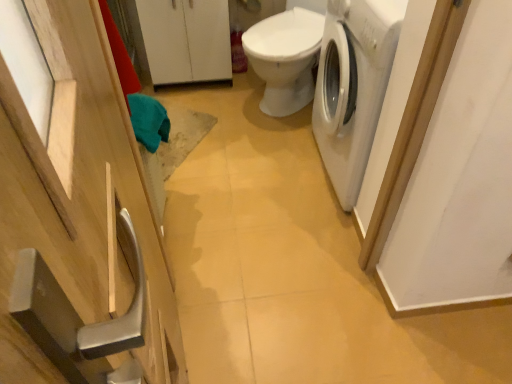
At what (x,y) coordinates should I click in order to perform the action: click on white matte cabinet at upper center, positioned as the 2th cabinetry in front-to-back order. Please return your answer as a coordinate pair (x, y). The height and width of the screenshot is (384, 512). Looking at the image, I should click on (186, 40).

Find the location of a particular element. This screenshot has height=384, width=512. natural wood cabinet at left, marked as the second cabinetry in a back-to-front arrangement is located at coordinates click(76, 211).

Find the location of `white matte washing machine at right`. white matte washing machine at right is located at coordinates (353, 86).

This screenshot has width=512, height=384. What do you see at coordinates (353, 86) in the screenshot?
I see `white matte washing machine at right` at bounding box center [353, 86].

Locate an element on the screen. This screenshot has width=512, height=384. white matte cabinet at upper center, placed as the first cabinetry when sorted from top to bottom is located at coordinates (186, 40).

From the picture: Is white matte washing machine at right positioned with its back to white matte cabinet at upper center, positioned as the 2th cabinetry in front-to-back order?

No, white matte washing machine at right is not facing away from white matte cabinet at upper center, positioned as the 2th cabinetry in front-to-back order.

Between white matte washing machine at right and white matte cabinet at upper center, placed as the first cabinetry when sorted from top to bottom, which one is positioned behind?

Positioned behind is white matte cabinet at upper center, placed as the first cabinetry when sorted from top to bottom.

Is white matte washing machine at right to the right of white matte cabinet at upper center, placed as the first cabinetry when sorted from top to bottom, from the viewer's perspective?

Indeed, white matte washing machine at right is positioned on the right side of white matte cabinet at upper center, placed as the first cabinetry when sorted from top to bottom.

Which of these two, white matte washing machine at right or white matte cabinet at upper center, arranged as the first cabinetry when viewed from the back, stands shorter?

white matte cabinet at upper center, arranged as the first cabinetry when viewed from the back.

Based on their sizes in the image, would you say white matte cabinet at upper center, arranged as the first cabinetry when viewed from the back, is bigger or smaller than white matte washing machine at right?

Considering their sizes, white matte cabinet at upper center, arranged as the first cabinetry when viewed from the back, takes up less space than white matte washing machine at right.

How far apart are white matte cabinet at upper center, the 2th cabinetry from the bottom, and white matte washing machine at right?

They are 88.44 centimeters apart.

From the picture: In terms of height, does white matte cabinet at upper center, the 2th cabinetry from the bottom, look taller or shorter compared to white matte washing machine at right?

In the image, white matte cabinet at upper center, the 2th cabinetry from the bottom, appears to be shorter than white matte washing machine at right.

Is white matte cabinet at upper center, arranged as the first cabinetry when viewed from the back, facing away from white matte washing machine at right?

white matte cabinet at upper center, arranged as the first cabinetry when viewed from the back, does not have its back to white matte washing machine at right.

Can you tell me how much natural wood cabinet at left, marked as the second cabinetry in a back-to-front arrangement, and white matte cabinet at upper center, the 2th cabinetry from the bottom, differ in facing direction?

The angular difference between natural wood cabinet at left, marked as the second cabinetry in a back-to-front arrangement, and white matte cabinet at upper center, the 2th cabinetry from the bottom, is 97.8 degrees.

Measure the distance between natural wood cabinet at left, the first cabinetry positioned from the front, and white matte cabinet at upper center, positioned as the 2th cabinetry in front-to-back order.

The distance of natural wood cabinet at left, the first cabinetry positioned from the front, from white matte cabinet at upper center, positioned as the 2th cabinetry in front-to-back order, is 1.61 meters.

Is natural wood cabinet at left, the 1th cabinetry in the bottom-to-top sequence, not close to white matte cabinet at upper center, arranged as the first cabinetry when viewed from the back?

Yes, natural wood cabinet at left, the 1th cabinetry in the bottom-to-top sequence, is far from white matte cabinet at upper center, arranged as the first cabinetry when viewed from the back.

Considering the points (55, 47) and (159, 42), which point is behind, point (55, 47) or point (159, 42)?

Positioned behind is point (159, 42).

Is white matte washing machine at right positioned with its back to white glossy toilet at center?

No, white matte washing machine at right's orientation is not away from white glossy toilet at center.

From a real-world perspective, is white matte washing machine at right physically located above or below white glossy toilet at center?

white matte washing machine at right is above white glossy toilet at center.

The height and width of the screenshot is (384, 512). In the image, there is a white matte washing machine at right. In order to click on toilet above it (from the image's perspective) in this screenshot , I will do pos(285,58).

Which is correct: white matte washing machine at right is inside white glossy toilet at center, or outside of it?

white matte washing machine at right is not enclosed by white glossy toilet at center.

At what (x,y) coordinates should I click in order to perform the action: click on toilet below the white matte cabinet at upper center, positioned as the 2th cabinetry in front-to-back order (from the image's perspective). Please return your answer as a coordinate pair (x, y). The width and height of the screenshot is (512, 384). Looking at the image, I should click on (285, 58).

In terms of width, does white glossy toilet at center look wider or thinner when compared to white matte cabinet at upper center, positioned as the 2th cabinetry in front-to-back order?

white glossy toilet at center is wider than white matte cabinet at upper center, positioned as the 2th cabinetry in front-to-back order.

Which object is closer to the camera taking this photo, white glossy toilet at center or white matte cabinet at upper center, positioned as the 2th cabinetry in front-to-back order?

white glossy toilet at center.

Are white glossy toilet at center and white matte cabinet at upper center, the 2th cabinetry from the bottom, beside each other?

No, white glossy toilet at center is not with white matte cabinet at upper center, the 2th cabinetry from the bottom.

Between white matte washing machine at right and natural wood cabinet at left, the 2th cabinetry positioned from the top, which one has more height?

Standing taller between the two is natural wood cabinet at left, the 2th cabinetry positioned from the top.

Considering the positions of objects white matte washing machine at right and natural wood cabinet at left, the 2th cabinetry positioned from the top, in the image provided, who is more to the right, white matte washing machine at right or natural wood cabinet at left, the 2th cabinetry positioned from the top,?

From the viewer's perspective, white matte washing machine at right appears more on the right side.

How many degrees apart are the facing directions of white matte washing machine at right and natural wood cabinet at left, marked as the second cabinetry in a back-to-front arrangement?

The angular difference between white matte washing machine at right and natural wood cabinet at left, marked as the second cabinetry in a back-to-front arrangement, is 172 degrees.

Is white matte washing machine at right facing away from natural wood cabinet at left, the first cabinetry positioned from the front?

No.

Based on the photo, does natural wood cabinet at left, the 2th cabinetry positioned from the top, come in front of white matte washing machine at right?

Yes, natural wood cabinet at left, the 2th cabinetry positioned from the top, is in front of white matte washing machine at right.

Which is correct: natural wood cabinet at left, marked as the second cabinetry in a back-to-front arrangement, is inside white matte washing machine at right, or outside of it?

natural wood cabinet at left, marked as the second cabinetry in a back-to-front arrangement, is located beyond the bounds of white matte washing machine at right.

Between natural wood cabinet at left, the 2th cabinetry positioned from the top, and white matte washing machine at right, which one has larger size?

Bigger between the two is white matte washing machine at right.

From a real-world perspective, between natural wood cabinet at left, the first cabinetry positioned from the front, and white matte washing machine at right, who is vertically lower?

In real-world perspective, white matte washing machine at right is lower.

Find the location of a particular element. The width and height of the screenshot is (512, 384). washing machine in front of the white matte cabinet at upper center, arranged as the first cabinetry when viewed from the back is located at coordinates (353, 86).

Where is `washing machine on the right of white matte cabinet at upper center, placed as the first cabinetry when sorted from top to bottom`? Image resolution: width=512 pixels, height=384 pixels. washing machine on the right of white matte cabinet at upper center, placed as the first cabinetry when sorted from top to bottom is located at coordinates (353, 86).

Consider the image. Considering their positions, is natural wood cabinet at left, the 2th cabinetry positioned from the top, positioned closer to white matte washing machine at right than white matte cabinet at upper center, placed as the first cabinetry when sorted from top to bottom?

Among the two, white matte cabinet at upper center, placed as the first cabinetry when sorted from top to bottom, is located nearer to white matte washing machine at right.

From the image, which object appears to be nearer to white matte washing machine at right, natural wood cabinet at left, the 1th cabinetry in the bottom-to-top sequence, or white glossy toilet at center?

white glossy toilet at center is closer to white matte washing machine at right.

Estimate the real-world distances between objects in this image. Which object is further from white matte cabinet at upper center, placed as the first cabinetry when sorted from top to bottom, white matte washing machine at right or white glossy toilet at center?

white matte washing machine at right is positioned further to the anchor white matte cabinet at upper center, placed as the first cabinetry when sorted from top to bottom.

Based on their spatial positions, is natural wood cabinet at left, the first cabinetry positioned from the front, or white matte washing machine at right further from white glossy toilet at center?

Based on the image, natural wood cabinet at left, the first cabinetry positioned from the front, appears to be further to white glossy toilet at center.

From the image, which object appears to be nearer to natural wood cabinet at left, the 1th cabinetry in the bottom-to-top sequence, white glossy toilet at center or white matte washing machine at right?

white matte washing machine at right.

When comparing their distances from natural wood cabinet at left, marked as the second cabinetry in a back-to-front arrangement, does white matte cabinet at upper center, the 2th cabinetry from the bottom, or white glossy toilet at center seem further?

white matte cabinet at upper center, the 2th cabinetry from the bottom, is further to natural wood cabinet at left, marked as the second cabinetry in a back-to-front arrangement.

Based on their spatial positions, is natural wood cabinet at left, the 1th cabinetry in the bottom-to-top sequence, or white matte cabinet at upper center, the 2th cabinetry from the bottom, closer to white glossy toilet at center?

Among the two, white matte cabinet at upper center, the 2th cabinetry from the bottom, is located nearer to white glossy toilet at center.

Based on their spatial positions, is white glossy toilet at center or white matte cabinet at upper center, positioned as the 2th cabinetry in front-to-back order, further from white matte washing machine at right?

The object further to white matte washing machine at right is white matte cabinet at upper center, positioned as the 2th cabinetry in front-to-back order.

Identify the location of toilet between natural wood cabinet at left, the 2th cabinetry positioned from the top, and white matte cabinet at upper center, positioned as the 2th cabinetry in front-to-back order, in the front-back direction. Image resolution: width=512 pixels, height=384 pixels. (285, 58).

Where is `washing machine located between natural wood cabinet at left, marked as the second cabinetry in a back-to-front arrangement, and white glossy toilet at center in the depth direction`? This screenshot has height=384, width=512. washing machine located between natural wood cabinet at left, marked as the second cabinetry in a back-to-front arrangement, and white glossy toilet at center in the depth direction is located at coordinates (353, 86).

The height and width of the screenshot is (384, 512). I want to click on toilet between white matte cabinet at upper center, positioned as the 2th cabinetry in front-to-back order, and white matte washing machine at right, so click(285, 58).

Image resolution: width=512 pixels, height=384 pixels. What are the coordinates of `washing machine between natural wood cabinet at left, the 2th cabinetry positioned from the top, and white matte cabinet at upper center, positioned as the 2th cabinetry in front-to-back order, from front to back` in the screenshot? It's located at (353, 86).